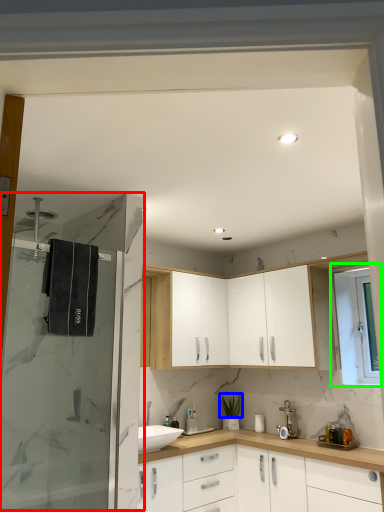
Question: Which is farther away from shower door (highlighted by a red box)? plant (highlighted by a blue box) or window (highlighted by a green box)?

Choices:
 (A) plant
 (B) window

Answer: (B)